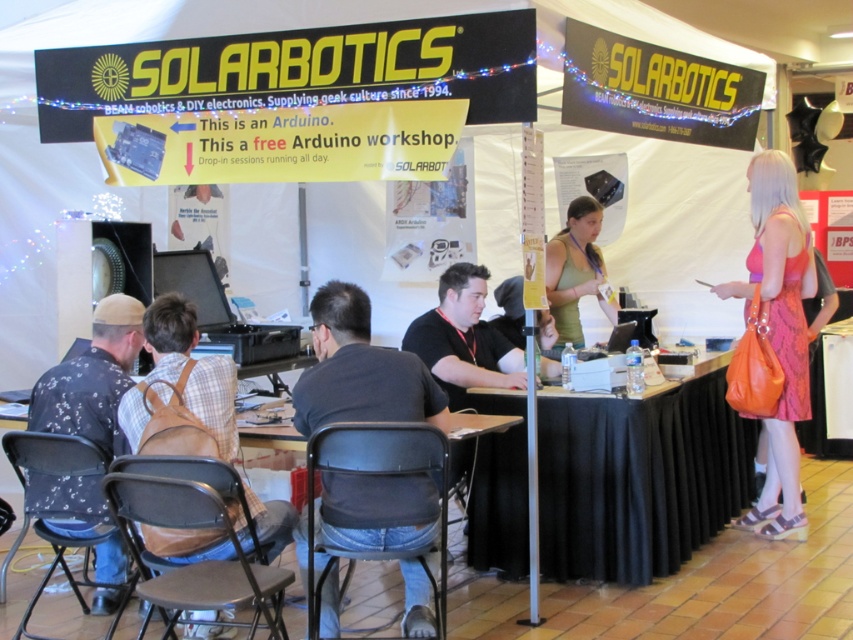
Question: Is black plastic chair at lower left smaller than floral shirt at left?

Choices:
 (A) yes
 (B) no

Answer: (A)

Question: Which object appears farthest from the camera in this image?

Choices:
 (A) floral shirt at left
 (B) metallic black chair at lower left

Answer: (B)

Question: Is brown leather backpack at lower left wider than green matte shirt at upper center?

Choices:
 (A) no
 (B) yes

Answer: (B)

Question: Which object is farther from the camera taking this photo?

Choices:
 (A) black fabric table at center
 (B) brown leather backpack at lower left
 (C) black plastic chair at lower left
 (D) black fabric shirt at center

Answer: (D)

Question: Can you confirm if black fabric table at center is positioned below metallic black chair at lower left?

Choices:
 (A) no
 (B) yes

Answer: (A)

Question: Which object is positioned farthest from the black plastic chair at center?

Choices:
 (A) black plastic table at center
 (B) green matte shirt at upper center

Answer: (B)